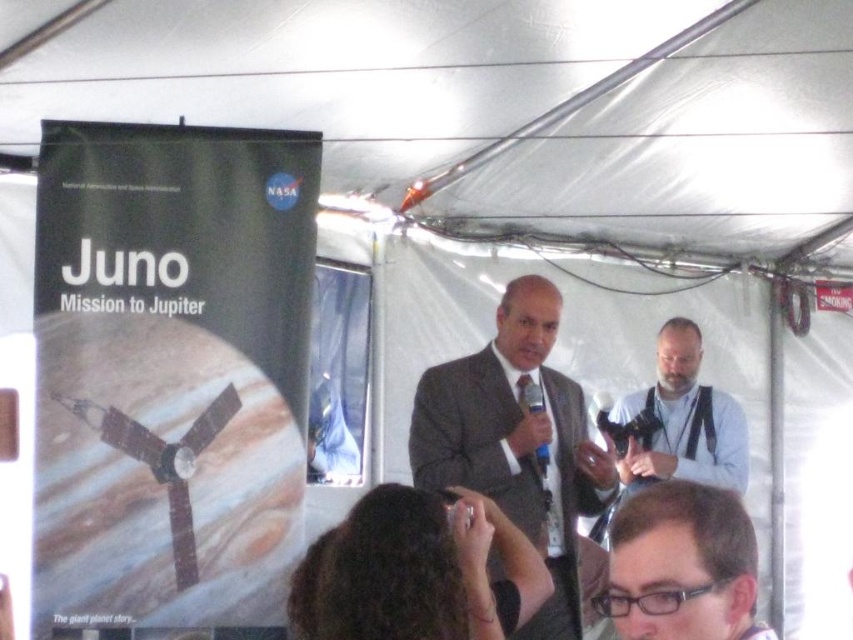
Does point (553, 416) come behind point (642, 490)?

Yes.

Based on the photo, does matte gray suit at center appear over clear plastic glasses at center?

No, matte gray suit at center is not above clear plastic glasses at center.

Consider the image. Who is more distant from viewer, (x=531, y=346) or (x=668, y=568)?

Positioned behind is point (x=531, y=346).

Find the location of a particular element. matte gray suit at center is located at coordinates (517, 442).

From the picture: Between clear plastic glasses at center and gray fabric camera at center, which one is positioned higher?

clear plastic glasses at center is higher up.

What do you see at coordinates (682, 564) in the screenshot?
I see `clear plastic glasses at center` at bounding box center [682, 564].

Which is in front, point (720, 611) or point (668, 472)?

Point (720, 611) is in front.

Locate an element on the screen. clear plastic glasses at center is located at coordinates (682, 564).

Can you confirm if matte gray suit at center is positioned to the right of gray fabric camera at center?

In fact, matte gray suit at center is to the left of gray fabric camera at center.

The height and width of the screenshot is (640, 853). What do you see at coordinates (517, 442) in the screenshot? I see `matte gray suit at center` at bounding box center [517, 442].

Where is `matte gray suit at center`? This screenshot has width=853, height=640. matte gray suit at center is located at coordinates (517, 442).